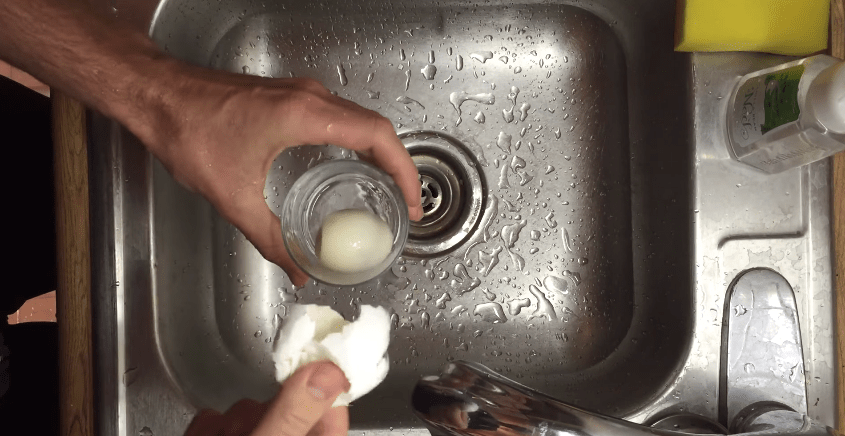
I want to click on floor, so click(x=25, y=317), click(x=20, y=80).